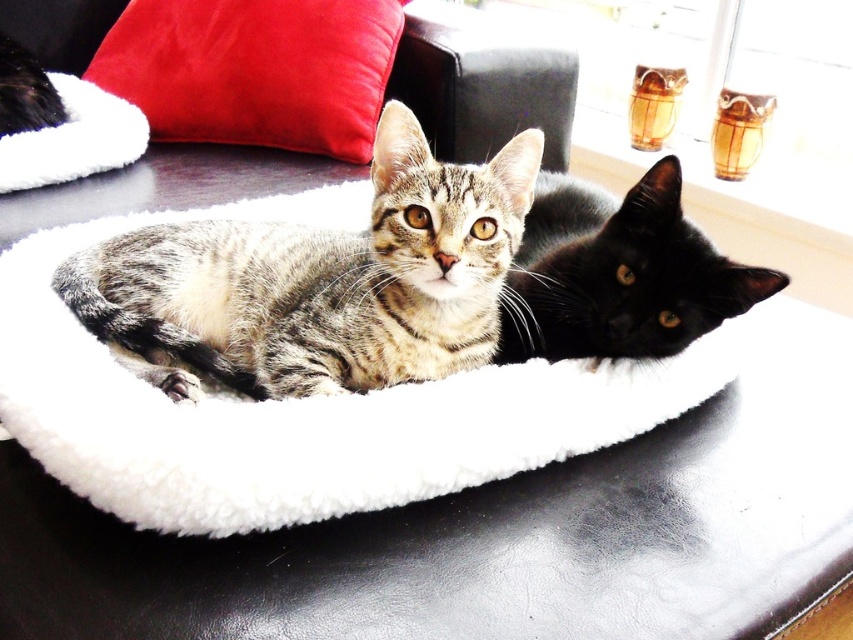
You are a pet owner who wants to ensure the black glossy cat at center is comfortable. Given that the white fluffy cat bed at center is under it, is the cat likely resting on the bed?

The white fluffy cat bed at center is positioned under the black glossy cat at center, so yes, the cat is likely resting on the bed.

You are a photographer setting up a shoot in this room. You need to place a small tripod exactly at the coordinates where the white fluffy cat bed at center is located. What are the coordinates you should input into your equipment to ensure the tripod is placed precisely on the bed?

The coordinates for the white fluffy cat bed at center are 0.637 on the x axis and 0.355 on the y axis. Input these into your equipment to place the tripod precisely on the bed.